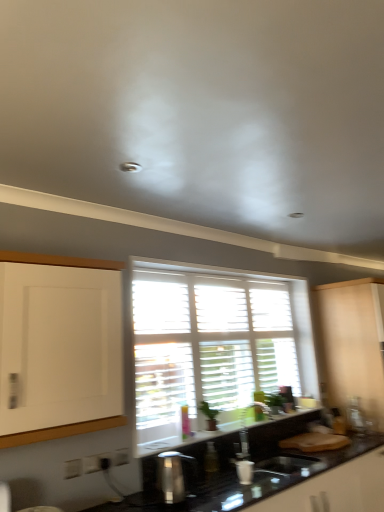
Question: Is black glossy countertop at lower center to the left or to the right of metallic silver soap dispenser at lower center, which is the 2th appliance in right-to-left order, in the image?

Choices:
 (A) left
 (B) right

Answer: (B)

Question: In terms of height, does black glossy countertop at lower center look taller or shorter compared to metallic silver soap dispenser at lower center, the first appliance positioned from the front?

Choices:
 (A) short
 (B) tall

Answer: (B)

Question: Which object is positioned farthest from the beige matte cabinet at right?

Choices:
 (A) black glossy countertop at lower center
 (B) metallic silver soap dispenser at lower center, the first appliance positioned from the front
 (C) white wooden blinds at center
 (D) metallic silver toaster at right, the second appliance from the left

Answer: (B)

Question: Which is nearer to the white wooden blinds at center?

Choices:
 (A) metallic silver soap dispenser at lower center, marked as the first appliance in a left-to-right arrangement
 (B) metallic silver toaster at right, the second appliance in the front-to-back sequence
 (C) black glossy countertop at lower center
 (D) beige matte cabinet at right

Answer: (C)